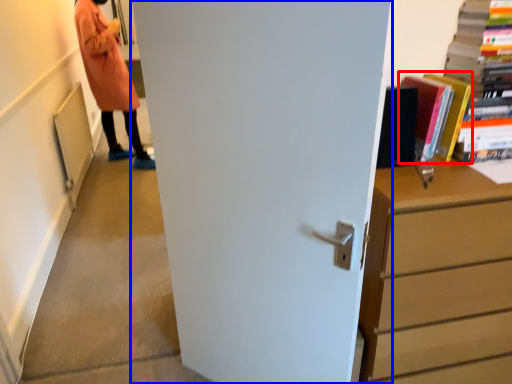
Question: Which of the following is the farthest to the observer, book (highlighted by a red box) or door (highlighted by a blue box)?

Choices:
 (A) book
 (B) door

Answer: (A)